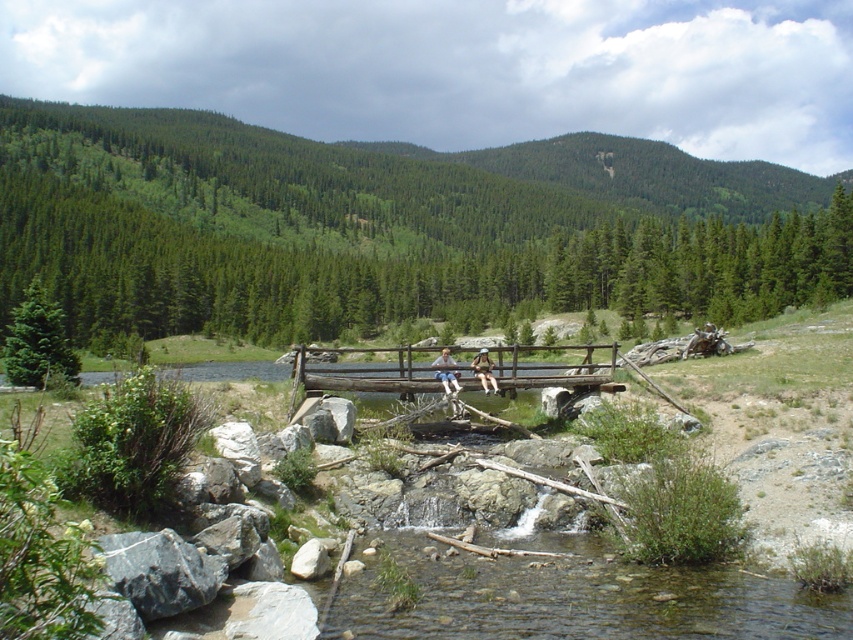
You are a hiker who wants to cross the stream using the brown wooden bridge at center. You are wearing the matte black shorts at center. Can you comfortably cross the bridge without getting your shorts wet?

The brown wooden bridge at center has a greater height compared to matte black shorts at center. Since the bridge is higher than the shorts, you can comfortably cross it without getting your shorts wet.

You are planning to sit on the light brown wooden bench at center to enjoy the view of the clear water at center. Considering the space they occupy, will you have enough room to comfortably sit on the bench while still being able to see the water?

The clear water at center occupies less space than the light brown wooden bench at center. Since the bench is larger, there should be enough space to sit comfortably and still see the water.